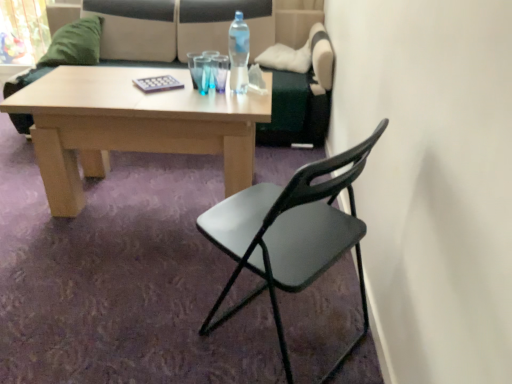
Question: Considering the positions of beige fabric couch at upper center and white fabric towel at center in the image, is beige fabric couch at upper center wider or thinner than white fabric towel at center?

Choices:
 (A) thin
 (B) wide

Answer: (B)

Question: From a real-world perspective, is beige fabric couch at upper center above or below white fabric towel at center?

Choices:
 (A) above
 (B) below

Answer: (B)

Question: Which object is positioned farthest from the transparent glass at center?

Choices:
 (A) clear plastic bottle at center
 (B) green fuzzy pillow at upper left
 (C) beige fabric couch at upper center
 (D) black plastic chair at center
 (E) white fabric towel at center

Answer: (B)

Question: Which object is positioned closest to the beige fabric couch at upper center?

Choices:
 (A) green fuzzy pillow at upper left
 (B) clear plastic bottle at center
 (C) black plastic chair at center
 (D) white fabric towel at center
 (E) transparent glass at center

Answer: (A)